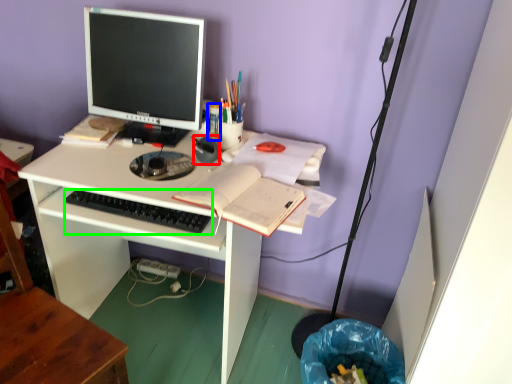
Question: Which is farther away from stationery (highlighted by a red box)? stationery (highlighted by a blue box) or computer keyboard (highlighted by a green box)?

Choices:
 (A) stationery
 (B) computer keyboard

Answer: (B)